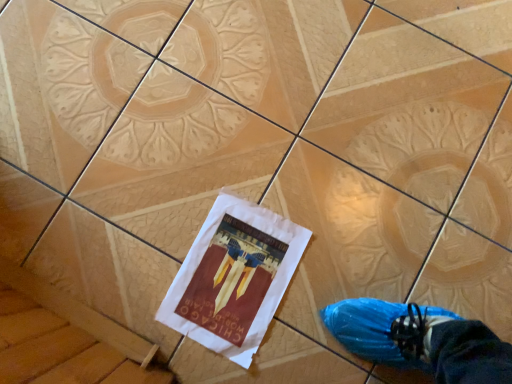
Identify the location of blank space situated above white paper postcard at lower left (from a real-world perspective). (234, 273).